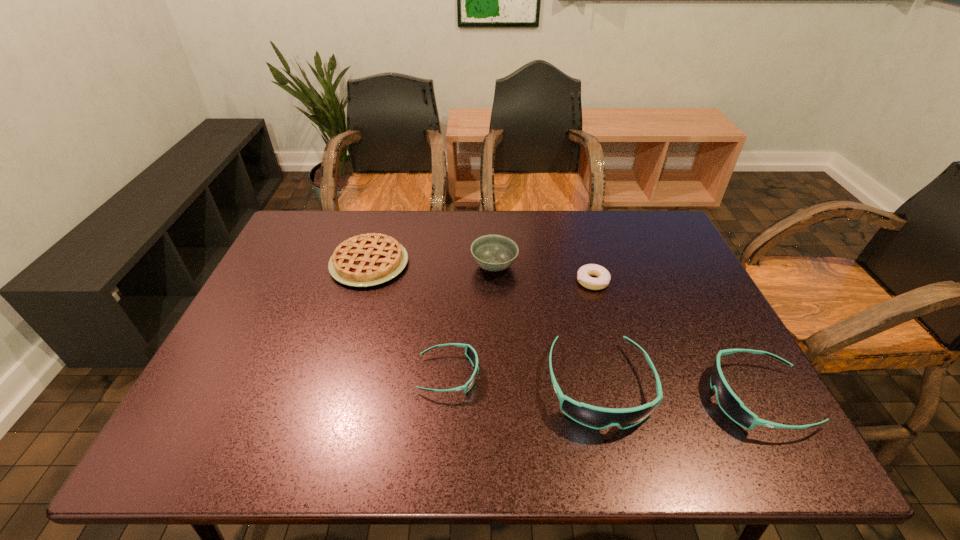
In order to click on the shortest sunglasses in this screenshot , I will do `click(470, 352)`.

The width and height of the screenshot is (960, 540). Find the location of `the second sunglasses from left to right`. the second sunglasses from left to right is located at coordinates (590, 416).

At what (x,y) coordinates should I click in order to perform the action: click on the second shortest sunglasses. Please return your answer as a coordinate pair (x, y). Looking at the image, I should click on (731, 405).

Find the location of `the rightmost sunglasses`. the rightmost sunglasses is located at coordinates (731, 405).

The width and height of the screenshot is (960, 540). What are the coordinates of `the shortest object` in the screenshot? It's located at (583, 275).

You are a GUI agent. You are given a task and a screenshot of the screen. Output one action in this format:
    pyautogui.click(x=<x>, y=<y>)
    Task: Click on the bowl
    
    Given the screenshot: What is the action you would take?
    pyautogui.click(x=494, y=253)

Where is `pie`? pie is located at coordinates tap(364, 260).

Locate an element on the screen. free space located on the front-facing side of the leftmost sunglasses is located at coordinates (553, 374).

At what (x,y) coordinates should I click in order to perform the action: click on free space located 0.220m on the front-facing side of the second tallest sunglasses. Please return your answer as a coordinate pair (x, y). The height and width of the screenshot is (540, 960). Looking at the image, I should click on (609, 397).

I want to click on free spot located on the front-facing side of the second tallest sunglasses, so click(636, 397).